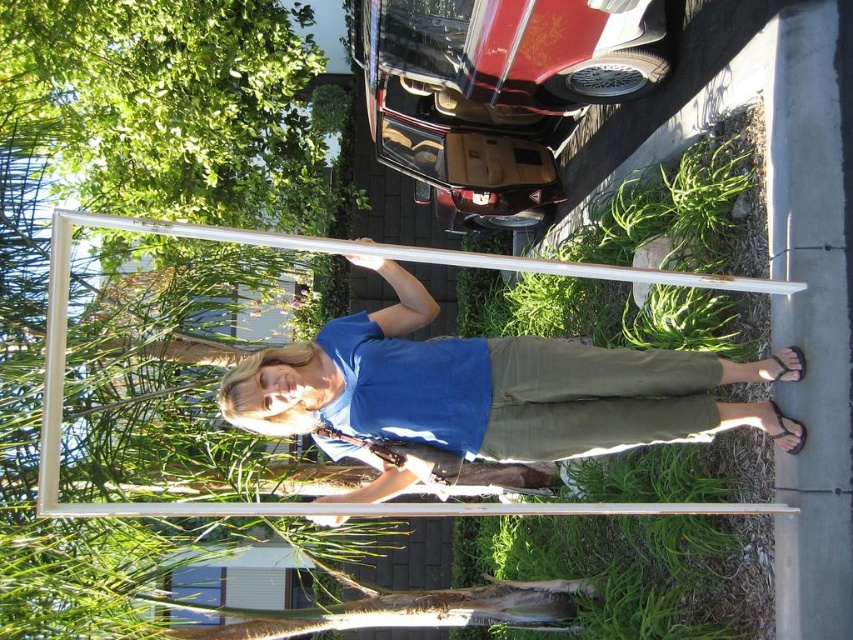
You are a photographer trying to capture the matte white surfboard at center and the white matte pole at center in a single shot. Which object should you focus on first to ensure both are in focus?

You should focus on the white matte pole at center first because it is farther away from you than the matte white surfboard at center, ensuring both are in focus when using depth of field.

Based on the photo, you are a delivery person carrying a 20 inch package. You need to place it between the matte white surfboard at center and the white matte pole at center. Is there enough space to fit the package between them?

The distance between the matte white surfboard at center and the white matte pole at center is 19.24 inches, which is slightly less than the 20 inch package. Therefore, the package cannot fit between them.

You are trying to decide which object to carry first between the matte white surfboard at center and the white matte pole at center. If you want to choose the thinner one, which should you pick?

The matte white surfboard at center is thinner than the white matte pole at center, so you should pick the matte white surfboard at center.